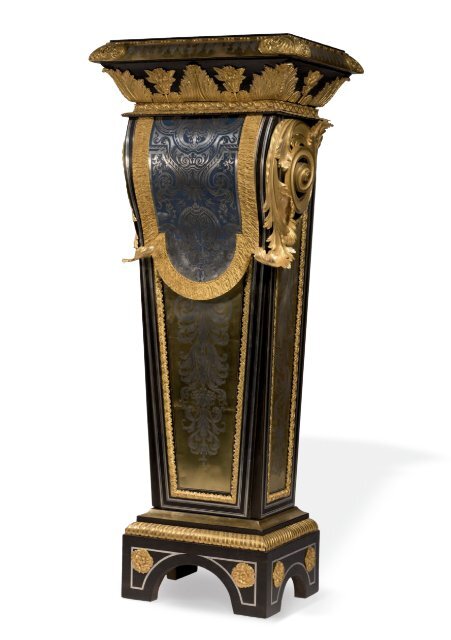
This screenshot has height=640, width=451. I want to click on gold circles on right side of artwork, so click(287, 563).